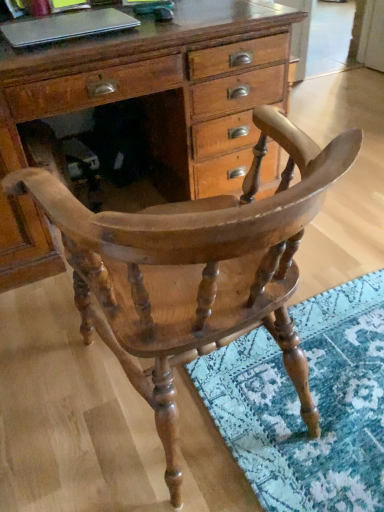
What do you see at coordinates (66, 26) in the screenshot?
I see `silver metallic laptop at upper left` at bounding box center [66, 26].

This screenshot has height=512, width=384. Find the location of `wooden chest of drawers at center`. wooden chest of drawers at center is located at coordinates (163, 87).

Locate an element on the screen. The height and width of the screenshot is (512, 384). wooden chair at center is located at coordinates click(195, 269).

Does wooden chair at center lie behind silver metallic laptop at upper left?

No, it is not.

From the picture: Between wooden chair at center and silver metallic laptop at upper left, which one has smaller size?

With smaller size is silver metallic laptop at upper left.

Is wooden chair at center not close to silver metallic laptop at upper left?

wooden chair at center is near silver metallic laptop at upper left, not far away.

Can you confirm if wooden chair at center is wider than silver metallic laptop at upper left?

Yes, wooden chair at center is wider than silver metallic laptop at upper left.

Considering the sizes of wooden chest of drawers at center and silver metallic laptop at upper left in the image, is wooden chest of drawers at center taller or shorter than silver metallic laptop at upper left?

Clearly, wooden chest of drawers at center is taller compared to silver metallic laptop at upper left.

At what (x,y) coordinates should I click in order to perform the action: click on laptop lying behind the wooden chest of drawers at center. Please return your answer as a coordinate pair (x, y). The image size is (384, 512). Looking at the image, I should click on (66, 26).

Does wooden chest of drawers at center turn towards silver metallic laptop at upper left?

No, wooden chest of drawers at center is not oriented towards silver metallic laptop at upper left.

Is silver metallic laptop at upper left at the right side of wooden chair at center?

No, silver metallic laptop at upper left is not to the right of wooden chair at center.

Is silver metallic laptop at upper left looking in the opposite direction of wooden chair at center?

No, silver metallic laptop at upper left is not facing the opposite direction of wooden chair at center.

From a real-world perspective, between silver metallic laptop at upper left and wooden chair at center, who is vertically higher?

silver metallic laptop at upper left is physically above.

Which object is wider, silver metallic laptop at upper left or wooden chair at center?

wooden chair at center.

Consider the image. From the image's perspective, is silver metallic laptop at upper left located beneath wooden chest of drawers at center?

No, from the image's perspective, silver metallic laptop at upper left is not below wooden chest of drawers at center.

Based on the photo, which object is closer to the camera, silver metallic laptop at upper left or wooden chest of drawers at center?

wooden chest of drawers at center is closer to the camera.

Can you confirm if wooden chest of drawers at center is wider than wooden chair at center?

Yes.

How distant is wooden chest of drawers at center from wooden chair at center?

wooden chest of drawers at center is 27.00 inches away from wooden chair at center.

Would you consider wooden chest of drawers at center to be distant from wooden chair at center?

No, wooden chest of drawers at center is not far away from wooden chair at center.

Can you confirm if wooden chest of drawers at center is smaller than wooden chair at center?

No.

Who is smaller, wooden chair at center or wooden chest of drawers at center?

wooden chair at center is smaller.

Based on the photo, is wooden chair at center situated inside wooden chest of drawers at center or outside?

wooden chair at center is located beyond the bounds of wooden chest of drawers at center.

Where is `chair lying below the silver metallic laptop at upper left (from the image's perspective)`? chair lying below the silver metallic laptop at upper left (from the image's perspective) is located at coordinates (195, 269).

Find the location of `laptop above the wooden chest of drawers at center (from the image's perspective)`. laptop above the wooden chest of drawers at center (from the image's perspective) is located at coordinates (66, 26).

Which object lies nearer to the anchor point silver metallic laptop at upper left, wooden chair at center or wooden chest of drawers at center?

wooden chest of drawers at center is positioned closer to the anchor silver metallic laptop at upper left.

Considering their positions, is wooden chair at center positioned further to wooden chest of drawers at center than silver metallic laptop at upper left?

The object further to wooden chest of drawers at center is wooden chair at center.

Considering their positions, is wooden chest of drawers at center positioned closer to wooden chair at center than silver metallic laptop at upper left?

wooden chest of drawers at center lies closer to wooden chair at center than the other object.

Estimate the real-world distances between objects in this image. Which object is closer to wooden chest of drawers at center, silver metallic laptop at upper left or wooden chair at center?

silver metallic laptop at upper left lies closer to wooden chest of drawers at center than the other object.

Consider the image. Based on their spatial positions, is wooden chest of drawers at center or wooden chair at center further from silver metallic laptop at upper left?

wooden chair at center is further to silver metallic laptop at upper left.

Based on their spatial positions, is silver metallic laptop at upper left or wooden chest of drawers at center closer to wooden chair at center?

wooden chest of drawers at center is positioned closer to the anchor wooden chair at center.

Find the location of a particular element. This screenshot has height=512, width=384. the chest of drawers between silver metallic laptop at upper left and wooden chair at center vertically is located at coordinates (163, 87).